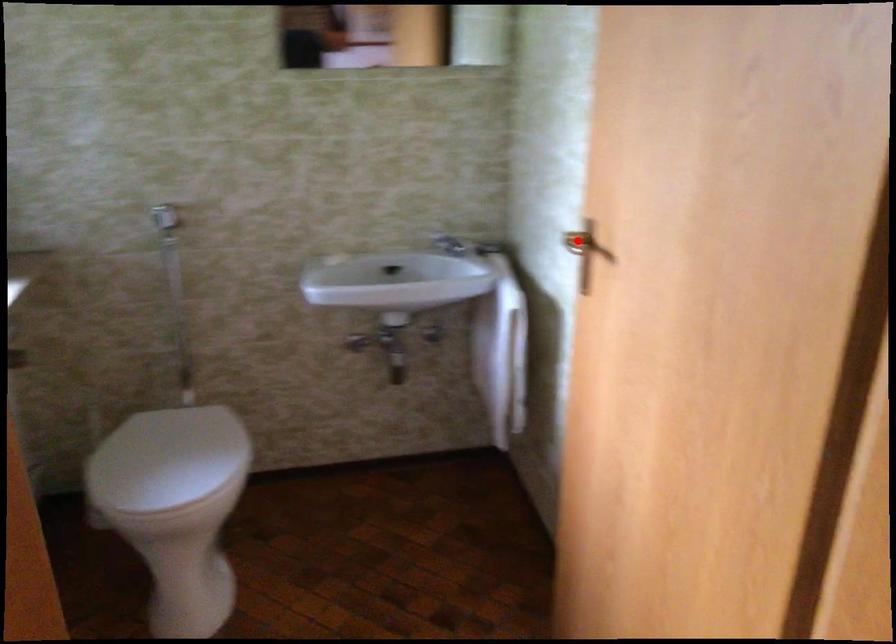
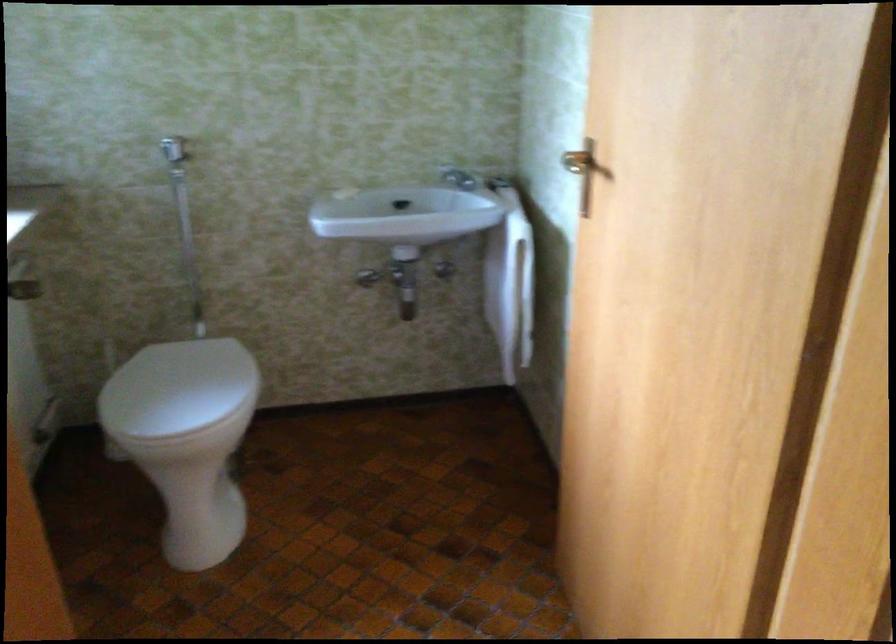
The point at the highlighted location is marked in the first image. Where is the corresponding point in the second image?

(575, 162)